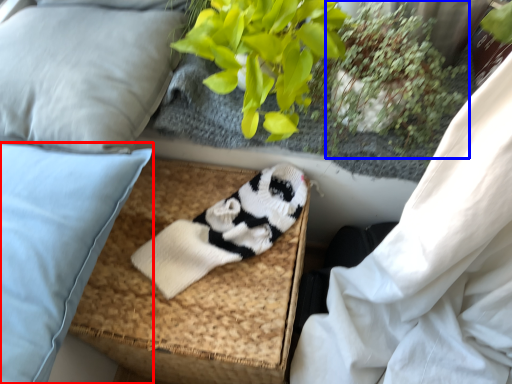
Question: Which object is further to the camera taking this photo, pillow (highlighted by a red box) or plant (highlighted by a blue box)?

Choices:
 (A) pillow
 (B) plant

Answer: (B)